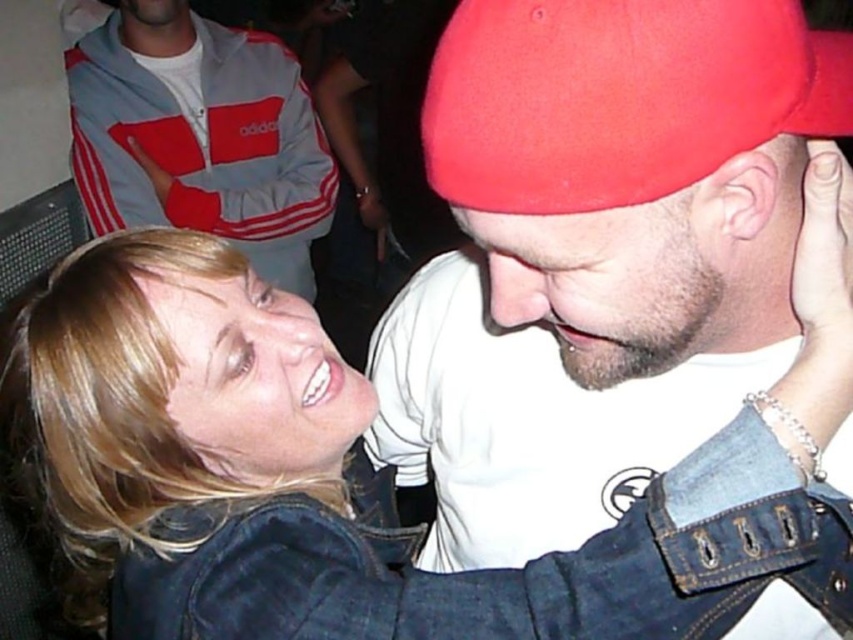
Is denim jacket at lower right closer to camera compared to beige matte skin at center?

No, it is not.

Who is higher up, denim jacket at lower right or beige matte skin at center?

beige matte skin at center is above.

Describe the element at coordinates (346, 493) in the screenshot. I see `denim jacket at lower right` at that location.

This screenshot has height=640, width=853. In order to click on denim jacket at lower right in this screenshot , I will do `click(346, 493)`.

Can you confirm if red matte beanie at center is bigger than denim jacket at lower right?

Incorrect, red matte beanie at center is not larger than denim jacket at lower right.

Between red matte beanie at center and denim jacket at lower right, which one has more height?

red matte beanie at center

The width and height of the screenshot is (853, 640). In order to click on red matte beanie at center in this screenshot , I will do `click(596, 256)`.

In the scene shown: Does denim jacket at lower right have a greater height compared to gray adidas track jacket at upper left?

In fact, denim jacket at lower right may be shorter than gray adidas track jacket at upper left.

You are a GUI agent. You are given a task and a screenshot of the screen. Output one action in this format:
    pyautogui.click(x=<x>, y=<y>)
    Task: Click on the denim jacket at lower right
    Image resolution: width=853 pixels, height=640 pixels.
    Given the screenshot: What is the action you would take?
    pyautogui.click(x=346, y=493)

Identify the location of denim jacket at lower right. This screenshot has width=853, height=640. (346, 493).